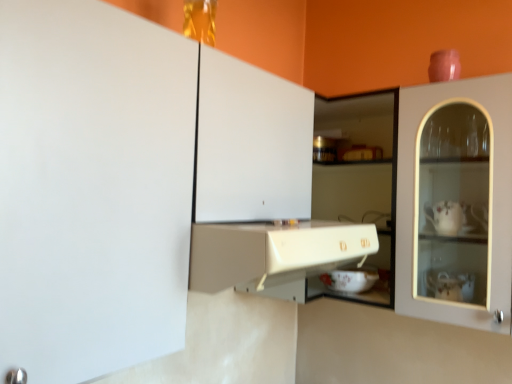
Question: Is white matte cabinet at upper left, acting as the 1th cabinetry starting from the top, positioned beyond the bounds of white glossy bowl at center?

Choices:
 (A) yes
 (B) no

Answer: (A)

Question: Can you confirm if white matte cabinet at upper left, acting as the 1th cabinetry starting from the top, is smaller than white glossy bowl at center?

Choices:
 (A) yes
 (B) no

Answer: (B)

Question: Is the depth of white matte cabinet at upper left, acting as the 1th cabinetry starting from the top, less than that of white glossy bowl at center?

Choices:
 (A) yes
 (B) no

Answer: (A)

Question: Can you confirm if white matte cabinet at upper left, the second cabinetry in the bottom-to-top sequence, is wider than white glossy bowl at center?

Choices:
 (A) yes
 (B) no

Answer: (A)

Question: Considering the relative positions of white matte cabinet at upper left, the second cabinetry in the bottom-to-top sequence, and white glossy bowl at center in the image provided, is white matte cabinet at upper left, the second cabinetry in the bottom-to-top sequence, behind white glossy bowl at center?

Choices:
 (A) yes
 (B) no

Answer: (B)

Question: Considering the positions of white glossy bowl at center and white matte cabinet at upper left, the second cabinetry in the bottom-to-top sequence, in the image, is white glossy bowl at center taller or shorter than white matte cabinet at upper left, the second cabinetry in the bottom-to-top sequence,?

Choices:
 (A) tall
 (B) short

Answer: (B)

Question: From the image's perspective, is white glossy bowl at center located above or below white matte cabinet at upper left, acting as the 1th cabinetry starting from the top?

Choices:
 (A) below
 (B) above

Answer: (A)

Question: Is white glossy bowl at center spatially inside white matte cabinet at upper left, the second cabinetry in the bottom-to-top sequence, or outside of it?

Choices:
 (A) outside
 (B) inside

Answer: (A)

Question: Considering their positions, is white glossy bowl at center located in front of or behind white matte cabinet at upper left, the second cabinetry in the bottom-to-top sequence?

Choices:
 (A) front
 (B) behind

Answer: (B)

Question: Considering their positions, is white matte cabinet at upper left, acting as the 1th cabinetry starting from the top, located in front of or behind white glossy bowl at center?

Choices:
 (A) front
 (B) behind

Answer: (A)

Question: Considering the positions of white matte cabinet at upper left, the second cabinetry in the bottom-to-top sequence, and white glossy bowl at center in the image, is white matte cabinet at upper left, the second cabinetry in the bottom-to-top sequence, wider or thinner than white glossy bowl at center?

Choices:
 (A) wide
 (B) thin

Answer: (A)

Question: From their relative heights in the image, would you say white matte cabinet at upper left, acting as the 1th cabinetry starting from the top, is taller or shorter than white glossy bowl at center?

Choices:
 (A) short
 (B) tall

Answer: (B)

Question: Is white matte cabinet at upper left, the second cabinetry in the bottom-to-top sequence, bigger or smaller than white glossy bowl at center?

Choices:
 (A) small
 (B) big

Answer: (B)

Question: From a real-world perspective, is matte white cabinet at center, placed as the 2th cabinetry when sorted from top to bottom, positioned above or below white glossy bowl at center?

Choices:
 (A) above
 (B) below

Answer: (A)

Question: Looking at the image, does matte white cabinet at center, placed as the 2th cabinetry when sorted from top to bottom, seem bigger or smaller compared to white glossy bowl at center?

Choices:
 (A) small
 (B) big

Answer: (B)